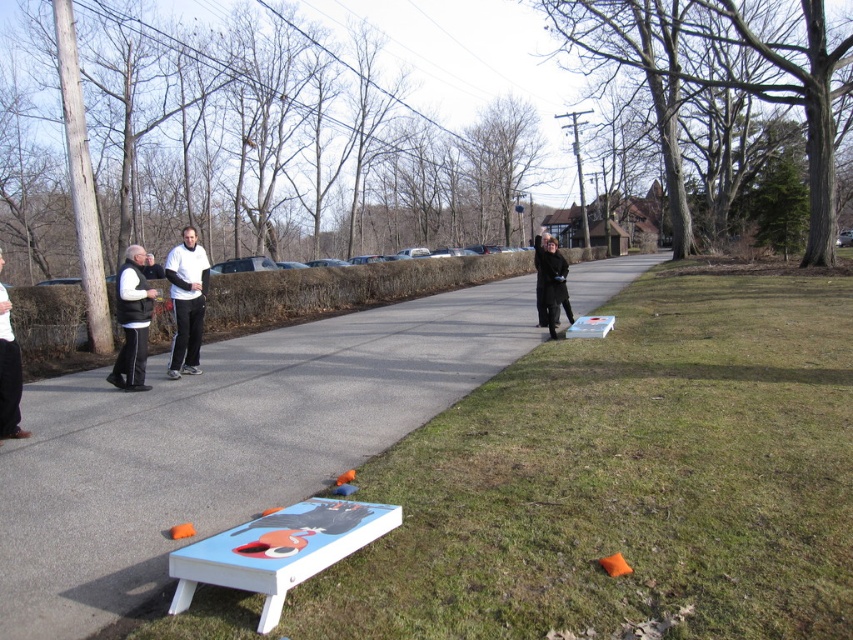
Question: Which of the following is the farthest from the observer?

Choices:
 (A) black vest at left
 (B) white matte tracksuit at center
 (C) black matte jacket at center
 (D) white painted pavement at lower center

Answer: (C)

Question: Among these points, which one is farthest from the camera?

Choices:
 (A) (181, 339)
 (B) (300, 428)
 (C) (120, 276)
 (D) (0, 333)

Answer: (A)

Question: Which object is positioned farthest from the black vest at left?

Choices:
 (A) black matte jacket at center
 (B) white matte vest at left
 (C) white painted pavement at lower center

Answer: (A)

Question: Does black vest at left have a larger size compared to white matte vest at left?

Choices:
 (A) no
 (B) yes

Answer: (A)

Question: Is white painted pavement at lower center positioned at the back of white matte vest at left?

Choices:
 (A) yes
 (B) no

Answer: (B)

Question: Considering the relative positions of white matte tracksuit at center and white matte vest at left in the image provided, where is white matte tracksuit at center located with respect to white matte vest at left?

Choices:
 (A) below
 (B) above

Answer: (B)